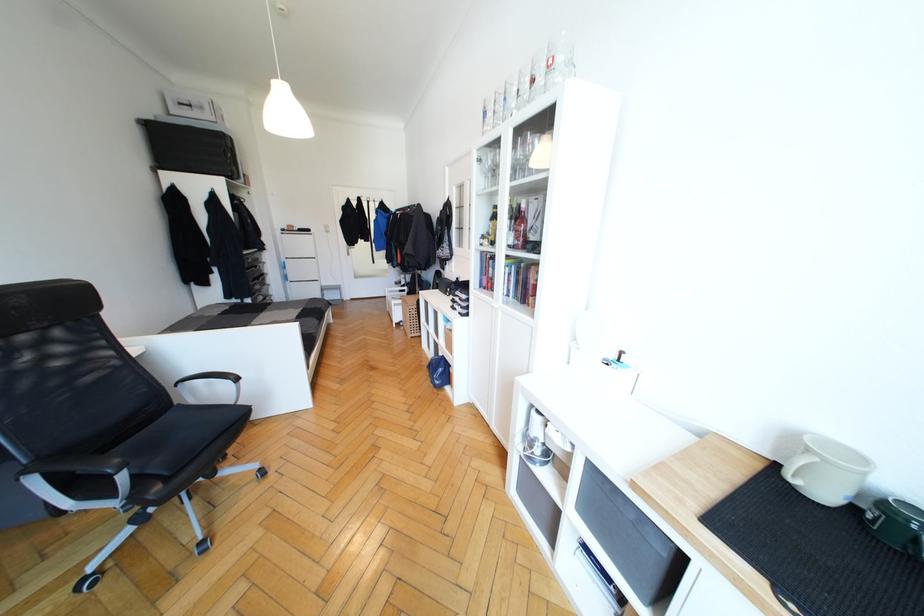
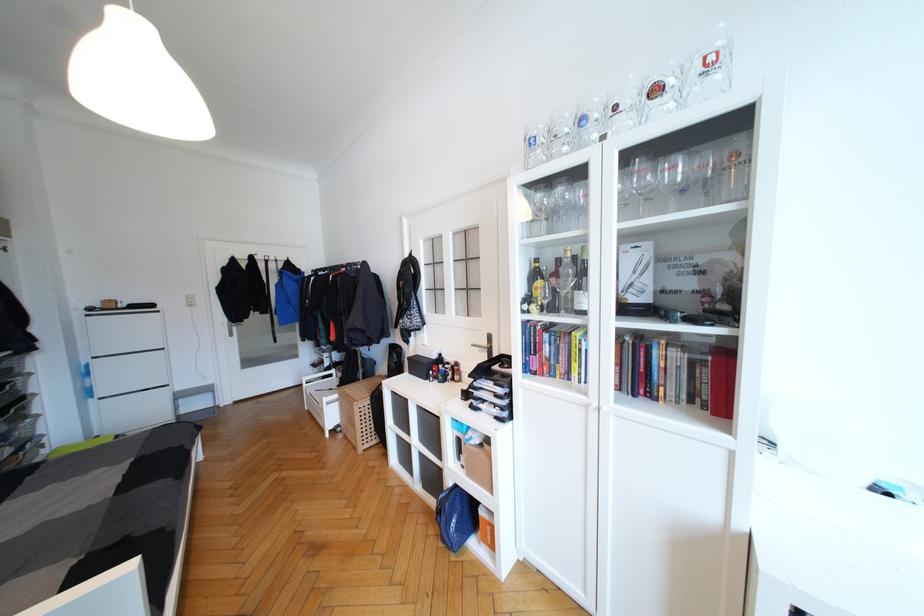
The point at (487, 237) is marked in the first image. Where is the corresponding point in the second image?

(531, 301)